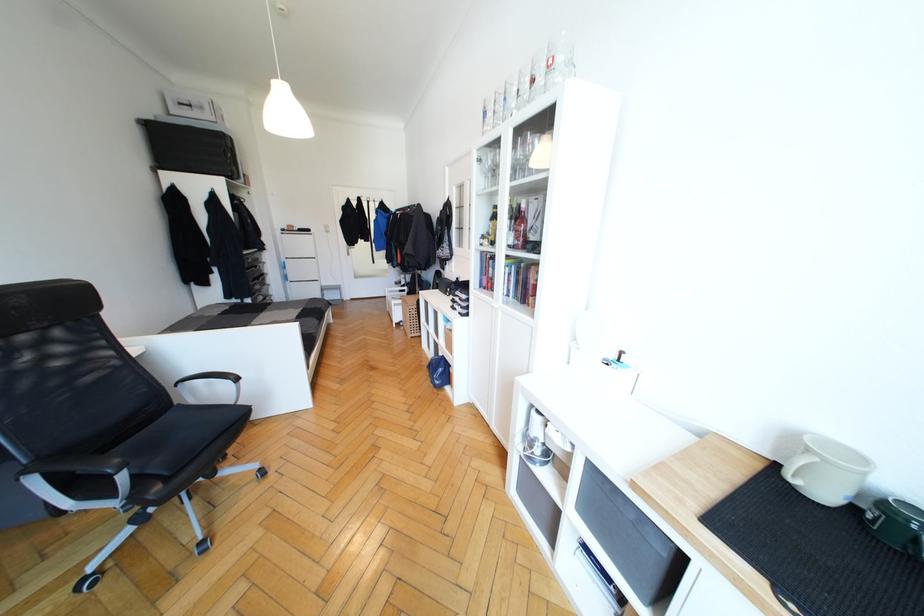
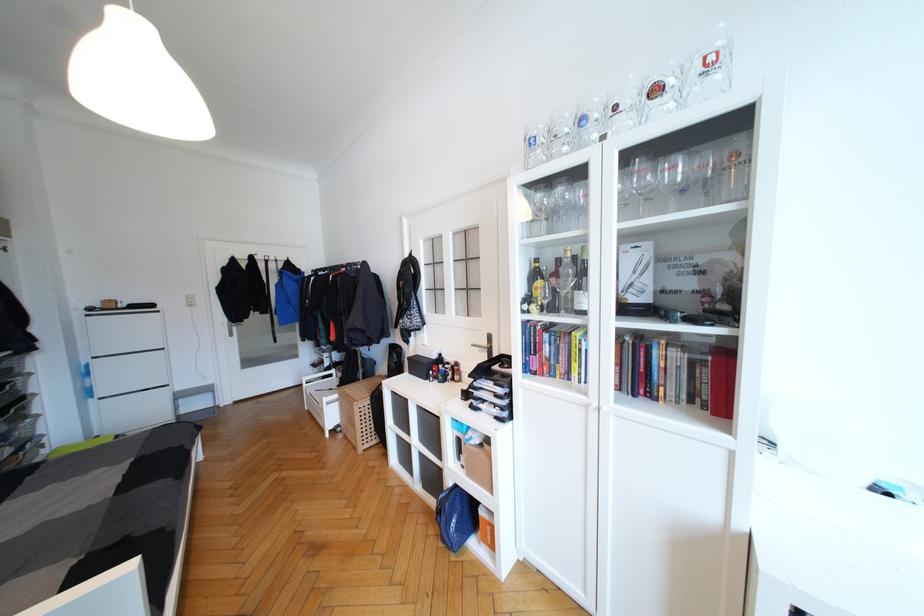
The point at (487, 237) is marked in the first image. Where is the corresponding point in the second image?

(531, 301)